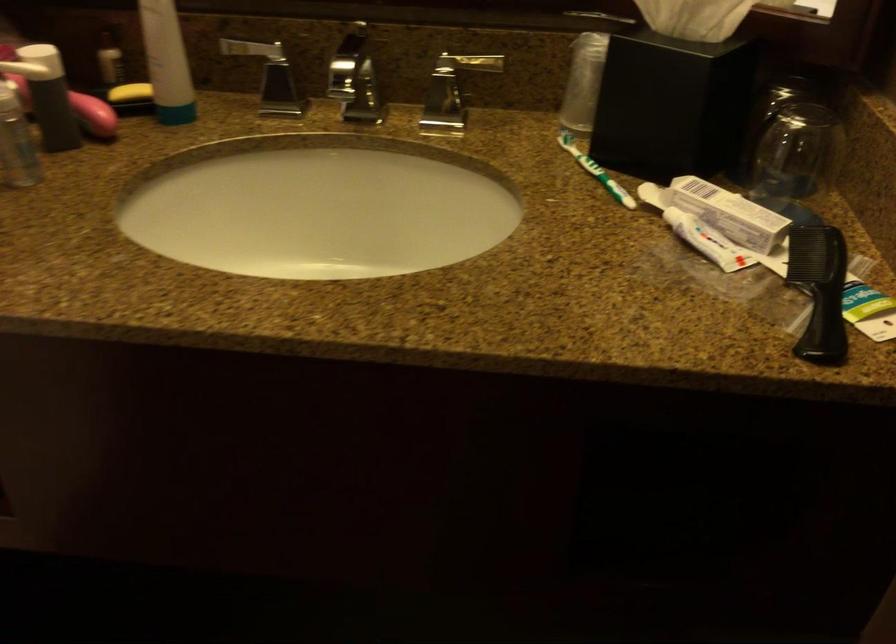
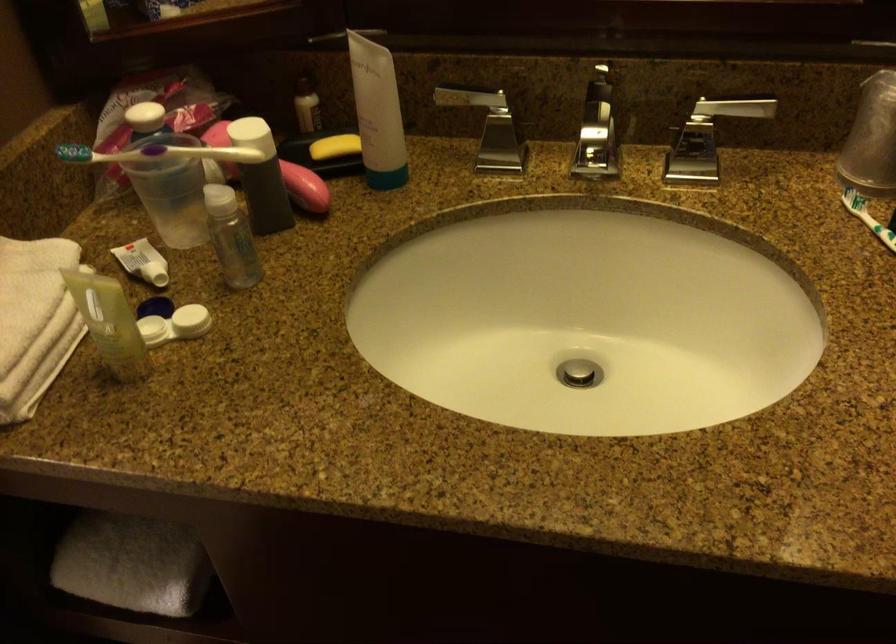
Which direction would the cameraman need to move to produce the second image?

The cameraman walked toward left, forward.